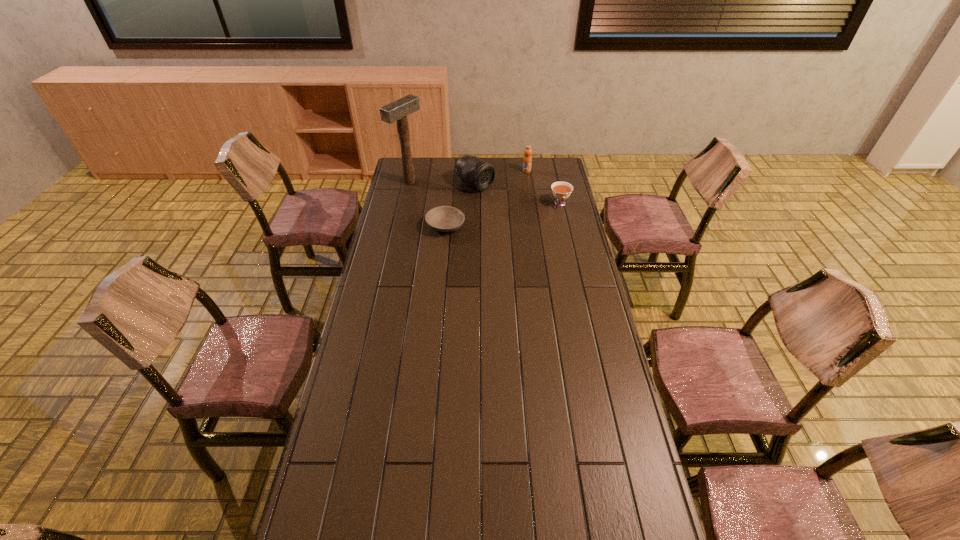
Find the location of a particular element. The image size is (960, 540). free region located 0.400m on the striking surface of the mallet is located at coordinates (484, 215).

Where is `free space located 0.200m on the striking surface of the mallet`? free space located 0.200m on the striking surface of the mallet is located at coordinates (451, 201).

Locate an element on the screen. The width and height of the screenshot is (960, 540). vacant point located 0.300m on the striking surface of the mallet is located at coordinates (467, 208).

Where is `free region located on the surface of the telephoto lens`? free region located on the surface of the telephoto lens is located at coordinates (528, 215).

Locate an element on the screen. vacant area situated on the surface of the telephoto lens is located at coordinates coord(532,218).

The width and height of the screenshot is (960, 540). I want to click on free space located on the surface of the telephoto lens, so click(524, 213).

Identify the location of vacant space located 0.350m on the front label of the second object from right to left. (513, 210).

Locate an element on the screen. The width and height of the screenshot is (960, 540). free region located 0.210m on the front label of the second object from right to left is located at coordinates (518, 194).

What are the coordinates of `vacant space located 0.260m on the front label of the second object from right to left` in the screenshot? It's located at (516, 200).

Locate an element on the screen. Image resolution: width=960 pixels, height=540 pixels. mallet that is at the far edge is located at coordinates (398, 110).